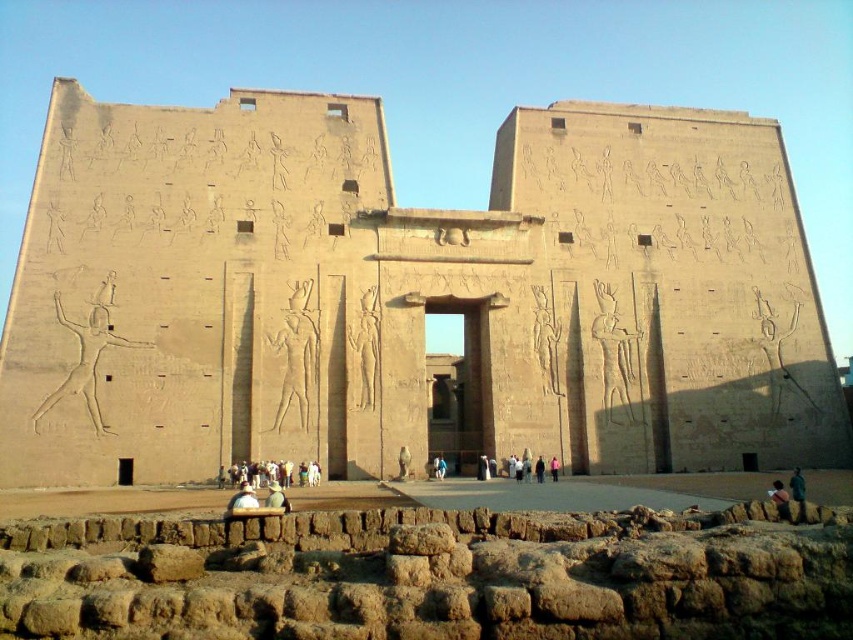
Does white cotton clothing at center appear under light brown wooden bench at center?

Yes, white cotton clothing at center is below light brown wooden bench at center.

Can you confirm if white cotton clothing at center is positioned to the left of light brown wooden bench at center?

No, white cotton clothing at center is not to the left of light brown wooden bench at center.

What do you see at coordinates (245, 472) in the screenshot?
I see `white cotton clothing at center` at bounding box center [245, 472].

You are a GUI agent. You are given a task and a screenshot of the screen. Output one action in this format:
    pyautogui.click(x=<x>, y=<y>)
    Task: Click on the white cotton clothing at center
    This screenshot has height=640, width=853.
    Given the screenshot: What is the action you would take?
    pyautogui.click(x=245, y=472)

Does sandstone temple at center appear on the right side of white cotton clothing at center?

Correct, you'll find sandstone temple at center to the right of white cotton clothing at center.

In the scene shown: Can you confirm if sandstone temple at center is smaller than white cotton clothing at center?

No, sandstone temple at center is not smaller than white cotton clothing at center.

Is point (770, 196) closer to viewer compared to point (239, 468)?

No, it is not.

Where is `sandstone temple at center`? Image resolution: width=853 pixels, height=640 pixels. sandstone temple at center is located at coordinates (407, 292).

Who is shorter, smooth beige figure at center-left or white cotton clothing at center?

With less height is white cotton clothing at center.

Looking at this image, who is more distant from viewer, (68,380) or (254,483)?

Positioned behind is point (68,380).

Where is `smooth beige figure at center-left`? smooth beige figure at center-left is located at coordinates (86, 353).